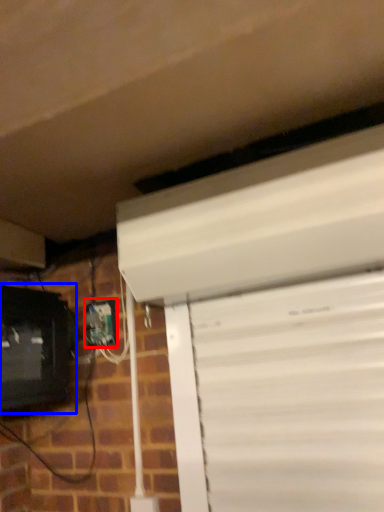
Question: Which object is closer to the camera taking this photo, electric outlet (highlighted by a red box) or computer monitor (highlighted by a blue box)?

Choices:
 (A) electric outlet
 (B) computer monitor

Answer: (B)